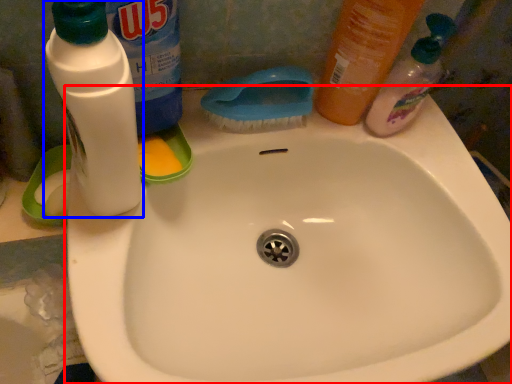
Question: Which object is further to the camera taking this photo, sink (highlighted by a red box) or bottle (highlighted by a blue box)?

Choices:
 (A) sink
 (B) bottle

Answer: (A)